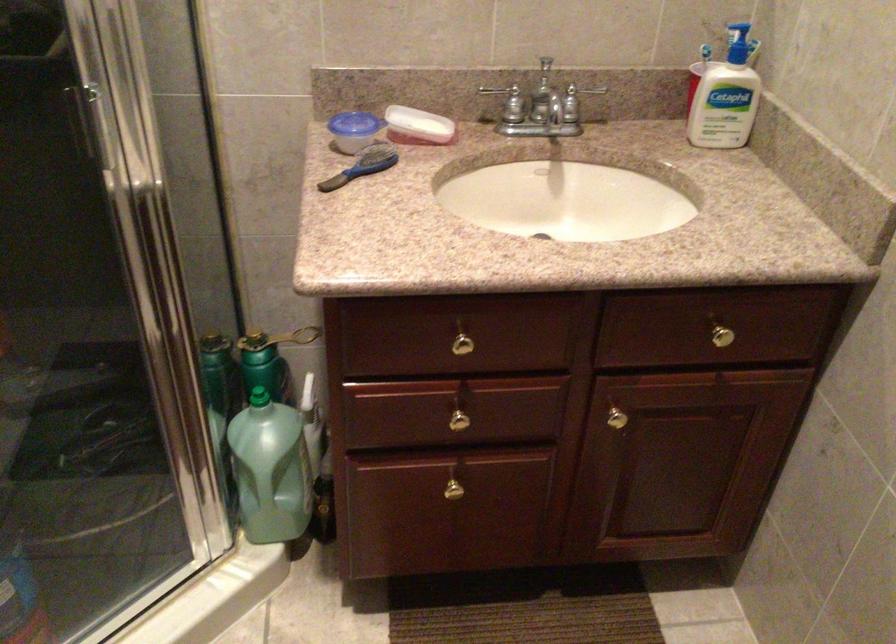
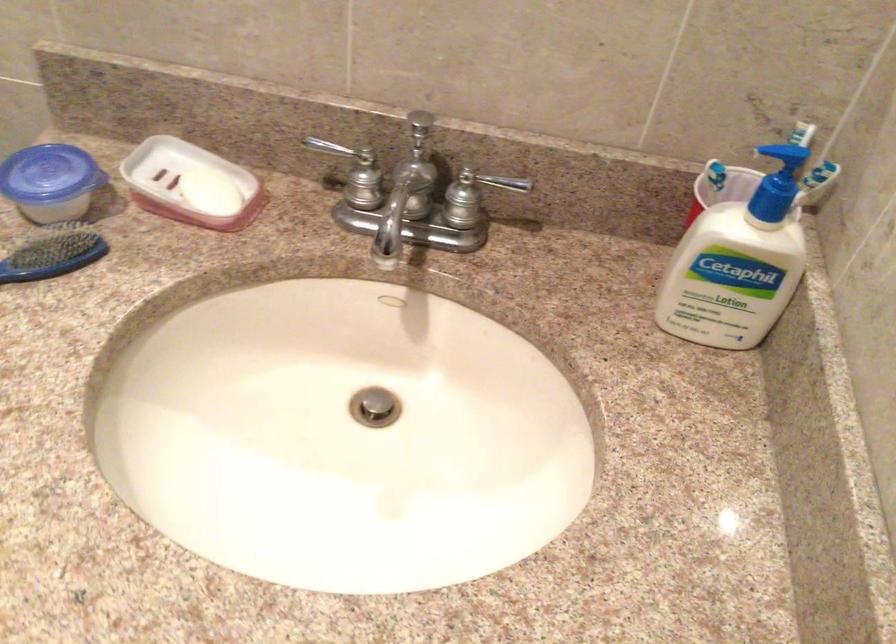
What movement of the cameraman would produce the second image?

The cameraman walked toward right, forward.